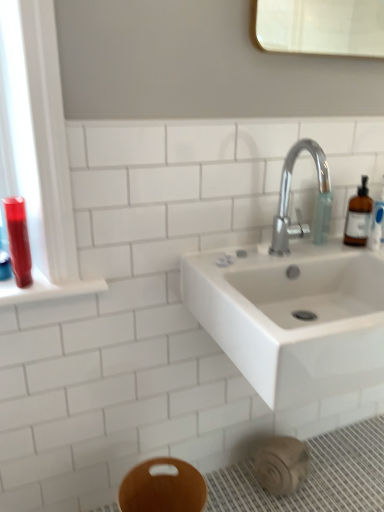
Question: Is shiny red plastic mouthwash at left looking in the opposite direction of translucent amber bottle at right?

Choices:
 (A) yes
 (B) no

Answer: (B)

Question: Is shiny red plastic mouthwash at left far from translucent amber bottle at right?

Choices:
 (A) no
 (B) yes

Answer: (A)

Question: Is shiny red plastic mouthwash at left positioned behind translucent amber bottle at right?

Choices:
 (A) no
 (B) yes

Answer: (A)

Question: Is shiny red plastic mouthwash at left wider than translucent amber bottle at right?

Choices:
 (A) yes
 (B) no

Answer: (B)

Question: Considering the relative positions of shiny red plastic mouthwash at left and translucent amber bottle at right in the image provided, is shiny red plastic mouthwash at left to the left of translucent amber bottle at right from the viewer's perspective?

Choices:
 (A) yes
 (B) no

Answer: (A)

Question: From a real-world perspective, relative to wooden bidet at lower center, is translucent amber bottle at right vertically above or below?

Choices:
 (A) below
 (B) above

Answer: (B)

Question: Does point (367, 198) appear closer or farther from the camera than point (140, 484)?

Choices:
 (A) farther
 (B) closer

Answer: (A)

Question: Is translucent amber bottle at right wider or thinner than wooden bidet at lower center?

Choices:
 (A) wide
 (B) thin

Answer: (B)

Question: Considering the relative positions of translucent amber bottle at right and wooden bidet at lower center in the image provided, is translucent amber bottle at right to the left or to the right of wooden bidet at lower center?

Choices:
 (A) right
 (B) left

Answer: (A)

Question: Is translucent plastic soap dispenser at upper right bigger or smaller than translucent amber bottle at right?

Choices:
 (A) big
 (B) small

Answer: (B)

Question: From the image's perspective, is translucent plastic soap dispenser at upper right located above or below translucent amber bottle at right?

Choices:
 (A) above
 (B) below

Answer: (B)

Question: Considering the positions of translucent plastic soap dispenser at upper right and translucent amber bottle at right in the image, is translucent plastic soap dispenser at upper right taller or shorter than translucent amber bottle at right?

Choices:
 (A) short
 (B) tall

Answer: (A)

Question: Do you think translucent plastic soap dispenser at upper right is within translucent amber bottle at right, or outside of it?

Choices:
 (A) inside
 (B) outside

Answer: (B)

Question: Would you say shiny red plastic mouthwash at left is inside or outside polished chrome faucet at upper right?

Choices:
 (A) inside
 (B) outside

Answer: (B)

Question: Considering their positions, is shiny red plastic mouthwash at left located in front of or behind polished chrome faucet at upper right?

Choices:
 (A) behind
 (B) front

Answer: (B)